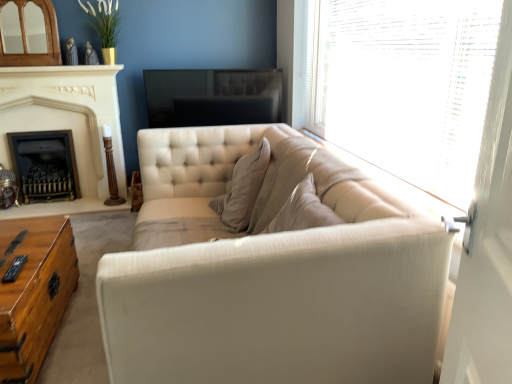
Question: Does translucent wood blinds at upper right turn towards white stone fireplace at left, positioned as the 1th fireplace in right-to-left order?

Choices:
 (A) yes
 (B) no

Answer: (A)

Question: Does translucent wood blinds at upper right appear on the right side of white stone fireplace at left, positioned as the 1th fireplace in right-to-left order?

Choices:
 (A) no
 (B) yes

Answer: (B)

Question: Considering the relative positions of translucent wood blinds at upper right and white stone fireplace at left, positioned as the 1th fireplace in right-to-left order, in the image provided, is translucent wood blinds at upper right to the left of white stone fireplace at left, positioned as the 1th fireplace in right-to-left order, from the viewer's perspective?

Choices:
 (A) no
 (B) yes

Answer: (A)

Question: From the image's perspective, is translucent wood blinds at upper right above white stone fireplace at left, the 2th fireplace in the left-to-right sequence?

Choices:
 (A) yes
 (B) no

Answer: (A)

Question: Is translucent wood blinds at upper right outside of white stone fireplace at left, positioned as the 1th fireplace in right-to-left order?

Choices:
 (A) no
 (B) yes

Answer: (B)

Question: Considering the positions of satin beige couch at center and black metal fireplace at left, positioned as the first fireplace in left-to-right order, in the image, is satin beige couch at center bigger or smaller than black metal fireplace at left, positioned as the first fireplace in left-to-right order,?

Choices:
 (A) small
 (B) big

Answer: (B)

Question: Is satin beige couch at center inside the boundaries of black metal fireplace at left, the second fireplace from the right, or outside?

Choices:
 (A) outside
 (B) inside

Answer: (A)

Question: From the image's perspective, is satin beige couch at center located above or below black metal fireplace at left, positioned as the first fireplace in left-to-right order?

Choices:
 (A) above
 (B) below

Answer: (B)

Question: In the image, is satin beige couch at center positioned in front of or behind black metal fireplace at left, positioned as the first fireplace in left-to-right order?

Choices:
 (A) front
 (B) behind

Answer: (A)

Question: Considering the positions of point (464, 46) and point (10, 223), is point (464, 46) closer or farther from the camera than point (10, 223)?

Choices:
 (A) closer
 (B) farther

Answer: (A)

Question: From a real-world perspective, is translucent wood blinds at upper right positioned above or below wooden trunk at lower left?

Choices:
 (A) below
 (B) above

Answer: (B)

Question: Looking at their shapes, would you say translucent wood blinds at upper right is wider or thinner than wooden trunk at lower left?

Choices:
 (A) wide
 (B) thin

Answer: (B)

Question: From the image's perspective, is translucent wood blinds at upper right positioned above or below wooden trunk at lower left?

Choices:
 (A) above
 (B) below

Answer: (A)

Question: Considering the positions of wooden trunk at lower left and white stone fireplace at left, positioned as the 1th fireplace in right-to-left order, in the image, is wooden trunk at lower left bigger or smaller than white stone fireplace at left, positioned as the 1th fireplace in right-to-left order,?

Choices:
 (A) small
 (B) big

Answer: (B)

Question: Is wooden trunk at lower left inside the boundaries of white stone fireplace at left, the 2th fireplace in the left-to-right sequence, or outside?

Choices:
 (A) outside
 (B) inside

Answer: (A)